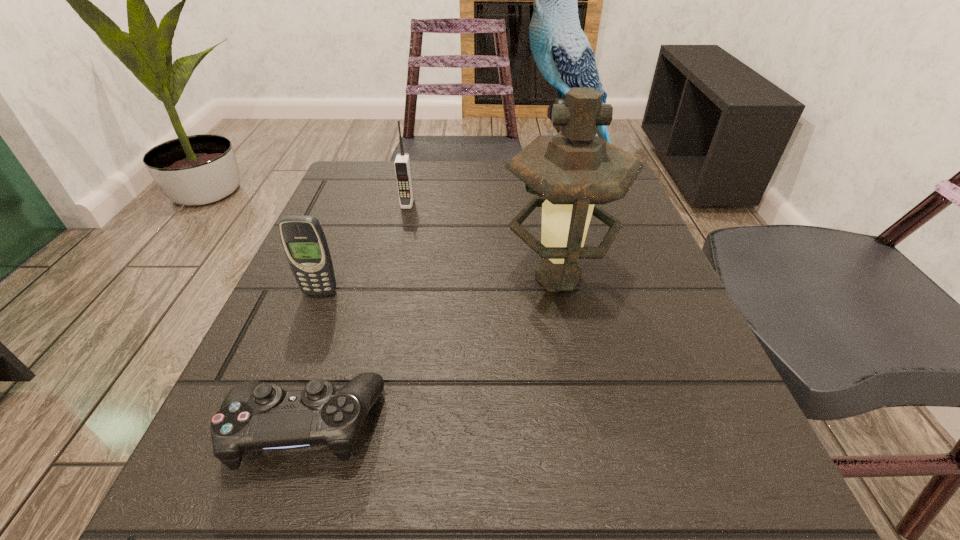
Where is `free space between the parakeet and the control`? The image size is (960, 540). free space between the parakeet and the control is located at coordinates (436, 305).

Locate an element on the screen. empty space that is in between the right cellular telephone and the control is located at coordinates (355, 315).

This screenshot has height=540, width=960. In order to click on free space between the parakeet and the taller cellular telephone in this screenshot , I will do `click(488, 193)`.

In order to click on vacant area that lies between the control and the parakeet in this screenshot , I will do `click(436, 305)`.

Image resolution: width=960 pixels, height=540 pixels. Find the location of `empty space between the left cellular telephone and the taller cellular telephone`. empty space between the left cellular telephone and the taller cellular telephone is located at coordinates (364, 248).

Where is `vacant area between the shortest object and the oil lamp`? vacant area between the shortest object and the oil lamp is located at coordinates (431, 352).

This screenshot has width=960, height=540. In order to click on object that is the second closest to the tallest object in this screenshot , I will do `click(402, 165)`.

I want to click on object that is the closest to the third tallest object, so click(x=575, y=171).

Where is `free region that satisfies the following two spatial constraints: 1. on the face of the parakeet; 2. on the screen of the nearer cellular telephone`? free region that satisfies the following two spatial constraints: 1. on the face of the parakeet; 2. on the screen of the nearer cellular telephone is located at coordinates [601, 293].

The width and height of the screenshot is (960, 540). Find the location of `vacant space that satisfies the following two spatial constraints: 1. on the face of the tallest object; 2. on the screen of the shorter cellular telephone`. vacant space that satisfies the following two spatial constraints: 1. on the face of the tallest object; 2. on the screen of the shorter cellular telephone is located at coordinates tap(601, 293).